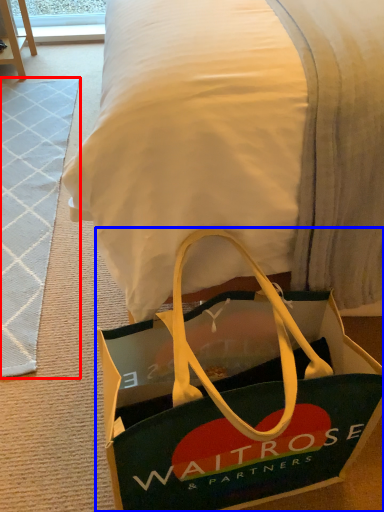
Question: Which point is closer to the camera, doormat (highlighted by a red box) or handbag (highlighted by a blue box)?

Choices:
 (A) doormat
 (B) handbag

Answer: (B)